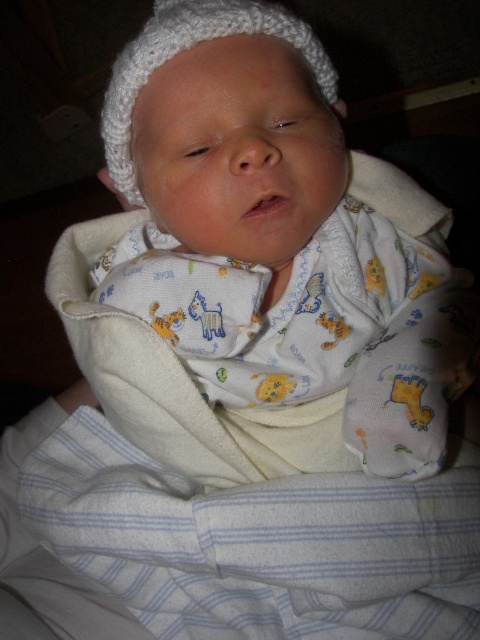
Question: Which point is closer to the camera taking this photo?

Choices:
 (A) (96, 560)
 (B) (204, 16)

Answer: (B)

Question: Does white striped blanket at lower left appear on the left side of white knitted hat at upper center?

Choices:
 (A) no
 (B) yes

Answer: (A)

Question: Can you confirm if white striped blanket at lower left is thinner than white knitted hat at upper center?

Choices:
 (A) yes
 (B) no

Answer: (B)

Question: Which point is farther to the camera?

Choices:
 (A) (120, 566)
 (B) (123, 64)

Answer: (A)

Question: Does white striped blanket at lower left appear over white knitted hat at upper center?

Choices:
 (A) yes
 (B) no

Answer: (B)